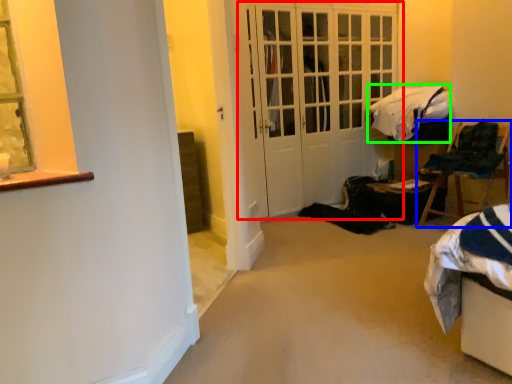
Question: Considering the real-world distances, which object is farthest from door (highlighted by a red box)? chair (highlighted by a blue box) or blanket (highlighted by a green box)?

Choices:
 (A) chair
 (B) blanket

Answer: (A)